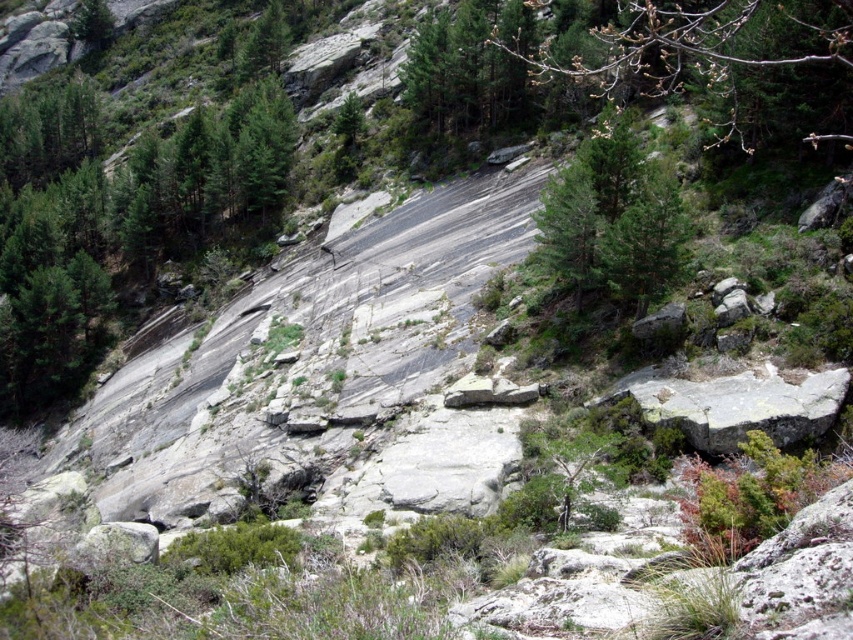
The image size is (853, 640). Identify the location of bare branches at upper center. (701, 45).

Who is taller, bare branches at upper center or green matte tree at center?

bare branches at upper center is taller.

Does point (729, 45) lie in front of point (662, 278)?

No, it is behind (662, 278).

At what (x,y) coordinates should I click in order to perform the action: click on bare branches at upper center. Please return your answer as a coordinate pair (x, y). The height and width of the screenshot is (640, 853). Looking at the image, I should click on (701, 45).